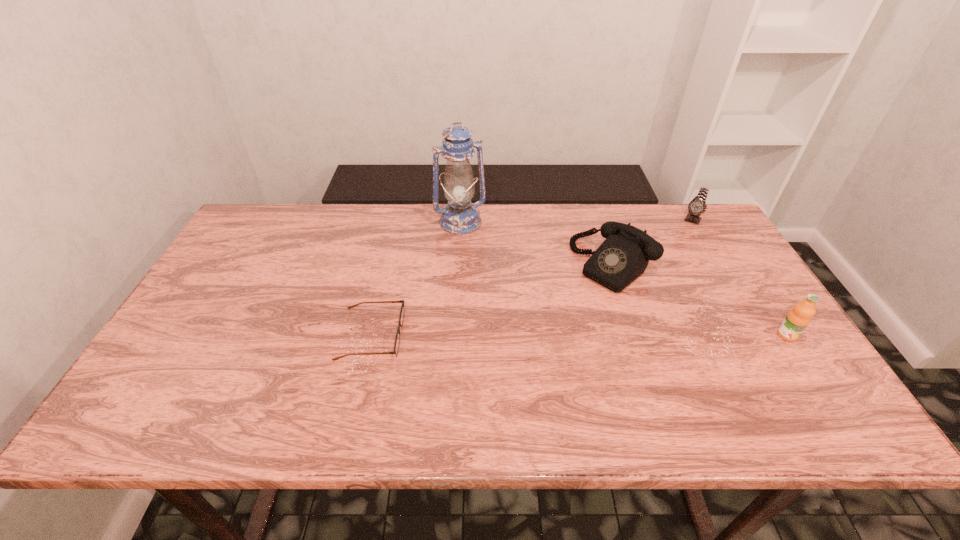
At what (x,y) coordinates should I click in order to perform the action: click on vacant area situated 0.080m on the dial of the third farthest object. Please return your answer as a coordinate pair (x, y). The image size is (960, 540). Looking at the image, I should click on (575, 301).

Locate an element on the screen. Image resolution: width=960 pixels, height=540 pixels. free space located on the dial of the third farthest object is located at coordinates (531, 342).

This screenshot has width=960, height=540. What are the coordinates of `vacant space positioned 0.240m on the front-facing side of the lantern` in the screenshot? It's located at (493, 284).

Find the location of a particular element. The height and width of the screenshot is (540, 960). free location located 0.190m on the front-facing side of the lantern is located at coordinates (488, 272).

The image size is (960, 540). Find the location of `vacant space positioned on the front-facing side of the lantern`. vacant space positioned on the front-facing side of the lantern is located at coordinates (502, 300).

Locate an element on the screen. vacant region located on the face of the watch is located at coordinates pos(676,254).

Where is `free space located 0.060m on the face of the watch`? This screenshot has width=960, height=540. free space located 0.060m on the face of the watch is located at coordinates (684, 237).

Where is `vacant space located on the face of the watch`? The width and height of the screenshot is (960, 540). vacant space located on the face of the watch is located at coordinates (680, 247).

Where is `telephone present at the far edge`? The width and height of the screenshot is (960, 540). telephone present at the far edge is located at coordinates [624, 255].

The width and height of the screenshot is (960, 540). Identify the location of lantern present at the far edge. (460, 216).